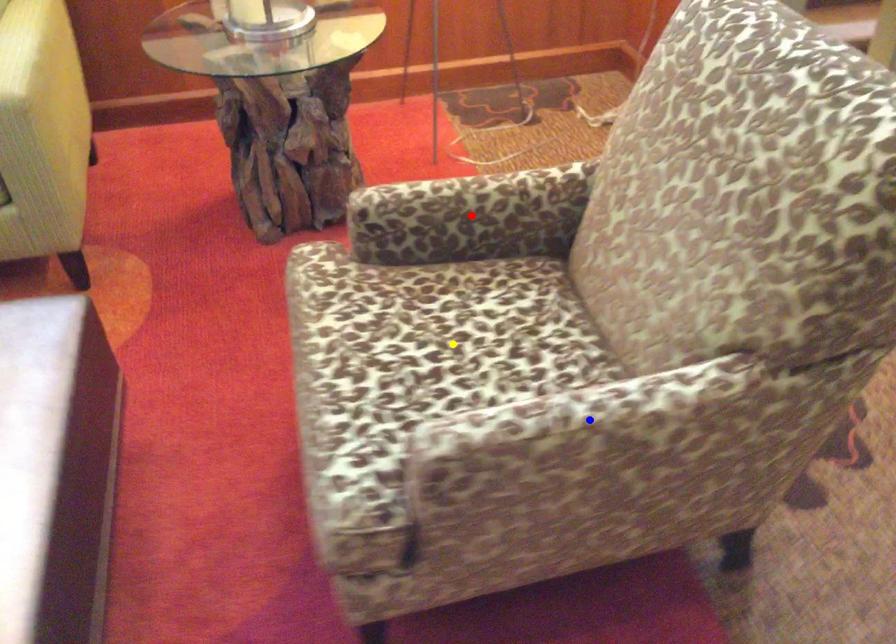
Order these from nearest to farthest:
yellow point | red point | blue point

blue point
yellow point
red point